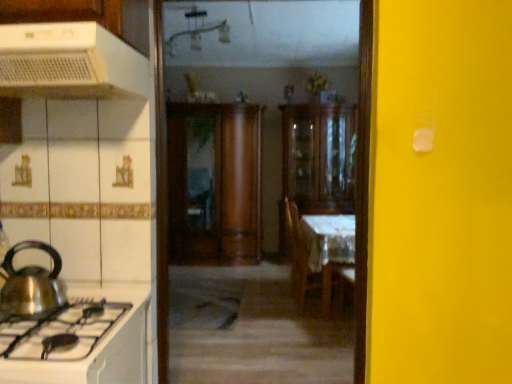
Question: Considering the positions of white plastic range hood at upper left, the 2th kitchen appliance positioned from the bottom, and white glossy stove at lower left in the image, is white plastic range hood at upper left, the 2th kitchen appliance positioned from the bottom, bigger or smaller than white glossy stove at lower left?

Choices:
 (A) small
 (B) big

Answer: (A)

Question: Is white plastic range hood at upper left, the 2th kitchen appliance positioned from the bottom, wider or thinner than white glossy stove at lower left?

Choices:
 (A) thin
 (B) wide

Answer: (A)

Question: Which object is positioned closest to the wooden cabinet at center, marked as the 1th cabinetry in a right-to-left arrangement?

Choices:
 (A) wooden chair at center
 (B) wooden cabinet at center, the first cabinetry in the left-to-right sequence
 (C) white glossy stove at lower left
 (D) shiny metallic kettle at left, marked as the second kitchen appliance in a top-to-bottom arrangement
 (E) white plastic range hood at upper left, the 2th kitchen appliance positioned from the bottom

Answer: (B)

Question: Considering the real-world distances, which object is farthest from the shiny metallic kettle at left, marked as the second kitchen appliance in a top-to-bottom arrangement?

Choices:
 (A) wooden cabinet at center, the second cabinetry in the right-to-left sequence
 (B) white cloth-covered table at center
 (C) white glossy stove at lower left
 (D) wooden cabinet at center, marked as the 1th cabinetry in a right-to-left arrangement
 (E) wooden chair at center

Answer: (D)